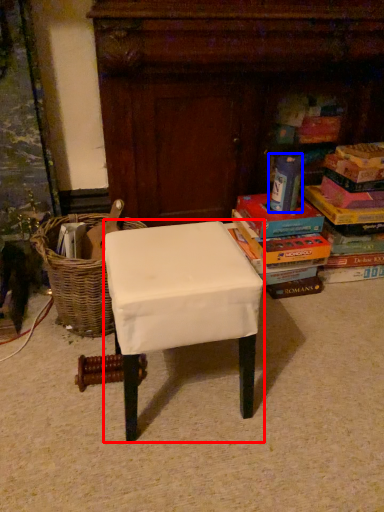
Question: Which of the following is the farthest to the observer, stool (highlighted by a red box) or paperback book (highlighted by a blue box)?

Choices:
 (A) stool
 (B) paperback book

Answer: (B)